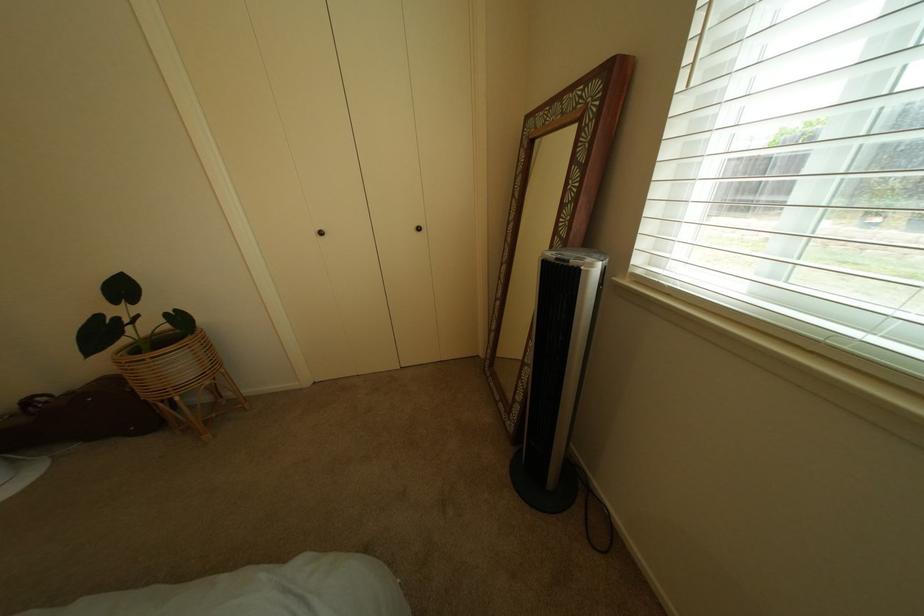
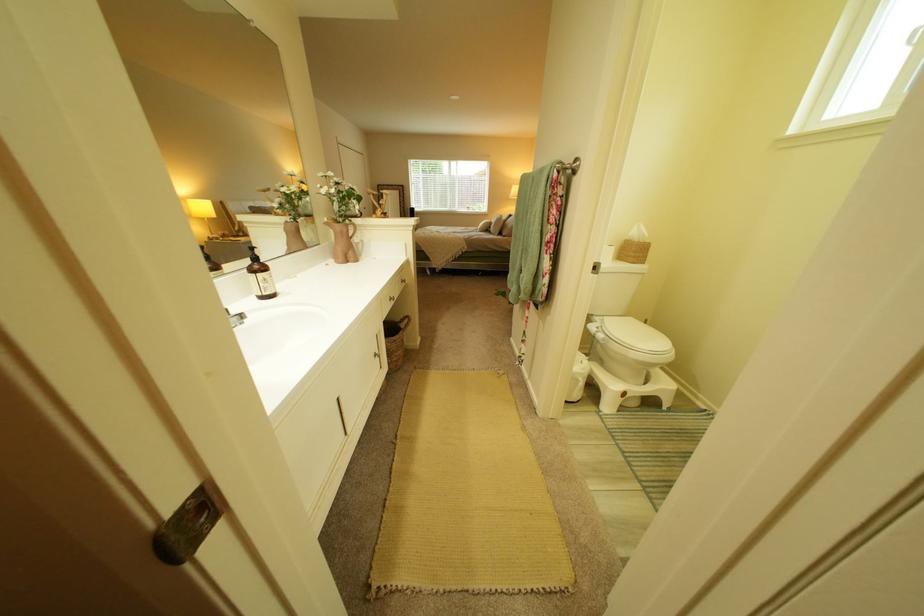
Question: I am providing you with two images of the same scene from different viewpoints. After the viewpoint changes to image2, which objects are now occluded?

Choices:
 (A) digital food thermometer
 (B) pink pitcher handle
 (C) white step stool
 (D) plant in wicker stand

Answer: (D)